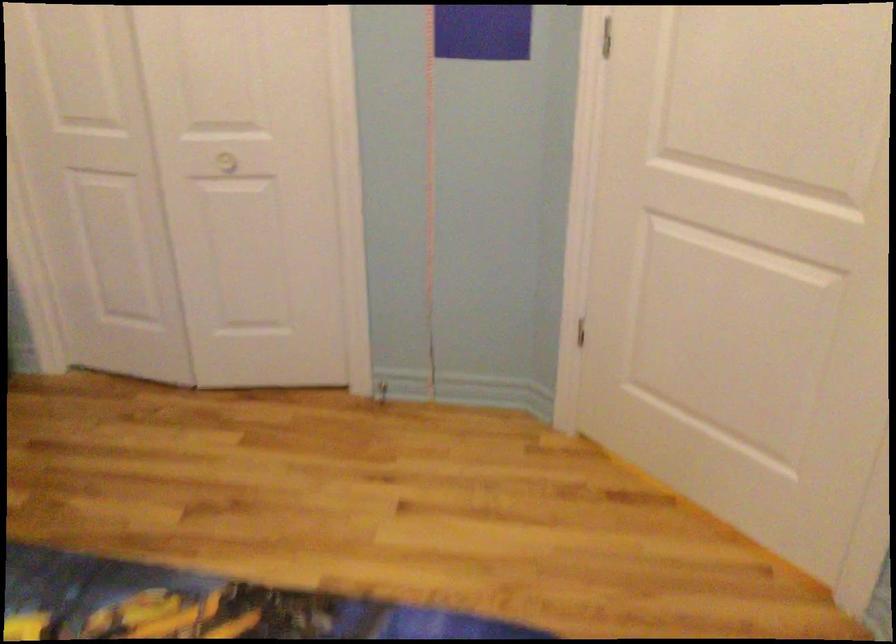
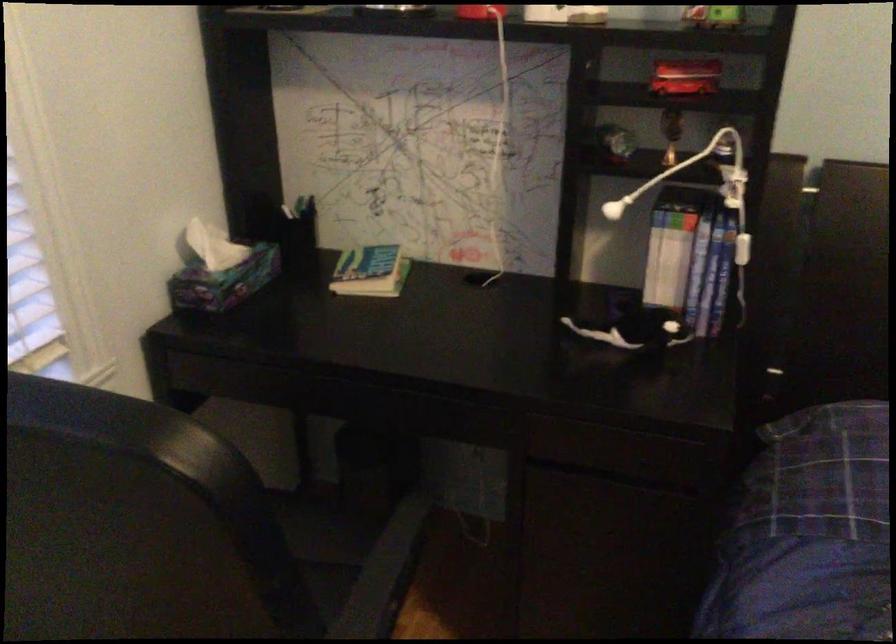
Based on the continuous images, in which direction is the camera rotating?

The rotation direction of the camera is left-down.